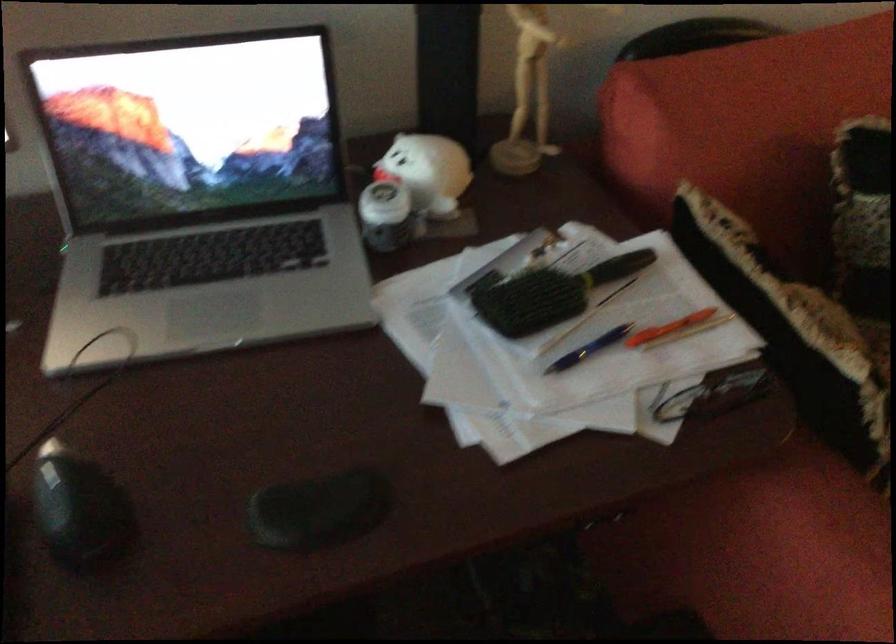
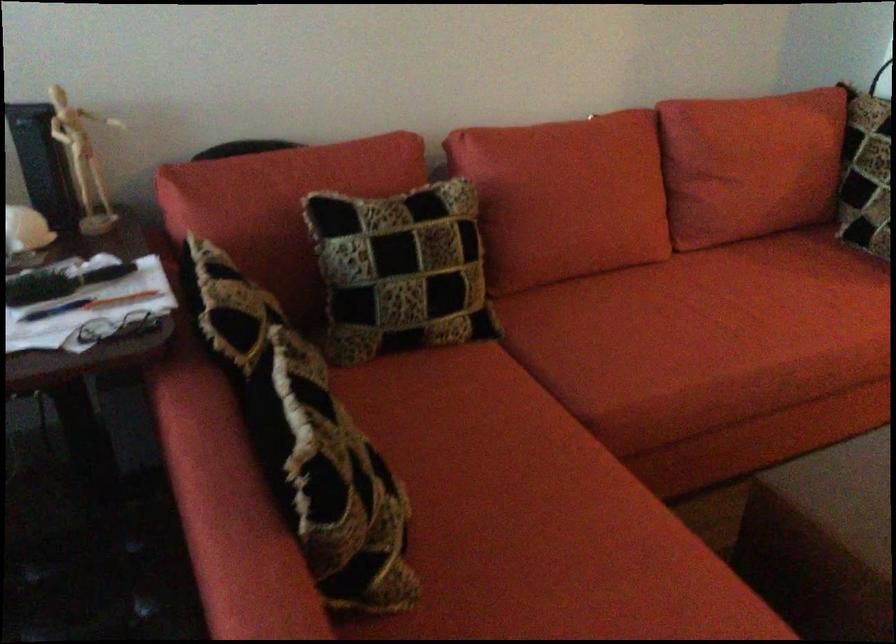
Question: I am providing you with two images of the same scene from different viewpoints. After the viewpoint changes to image2, which objects are now occluded?

Choices:
 (A) red sofa sitting surface
 (B) checkered throw pillow
 (C) pair of eyeglasses
 (D) none of these

Answer: (D)